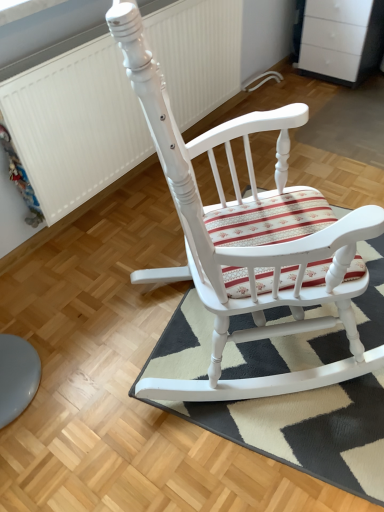
Where is `vacant space underneath white painted wood rocking chair at center (from a real-world perspective)`? The width and height of the screenshot is (384, 512). vacant space underneath white painted wood rocking chair at center (from a real-world perspective) is located at coordinates (208, 331).